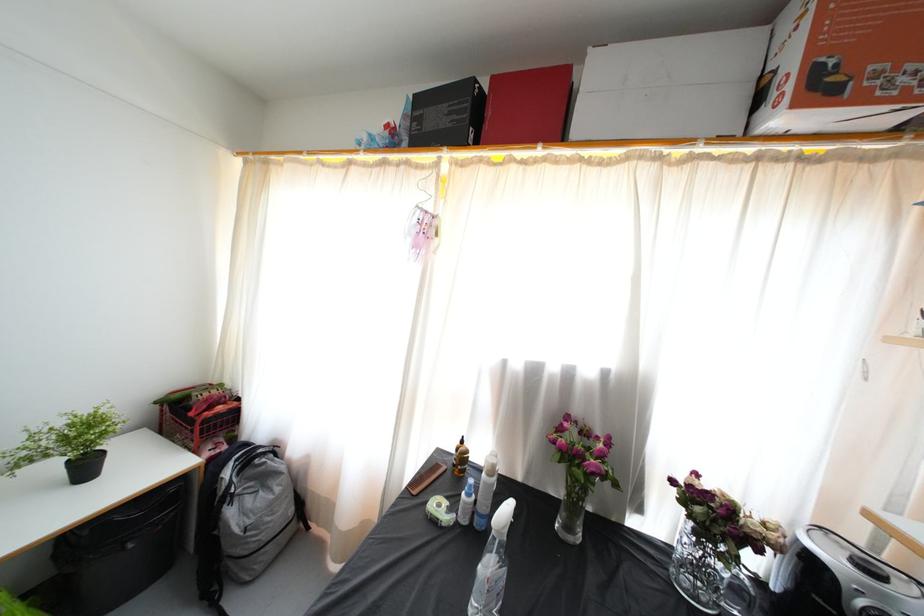
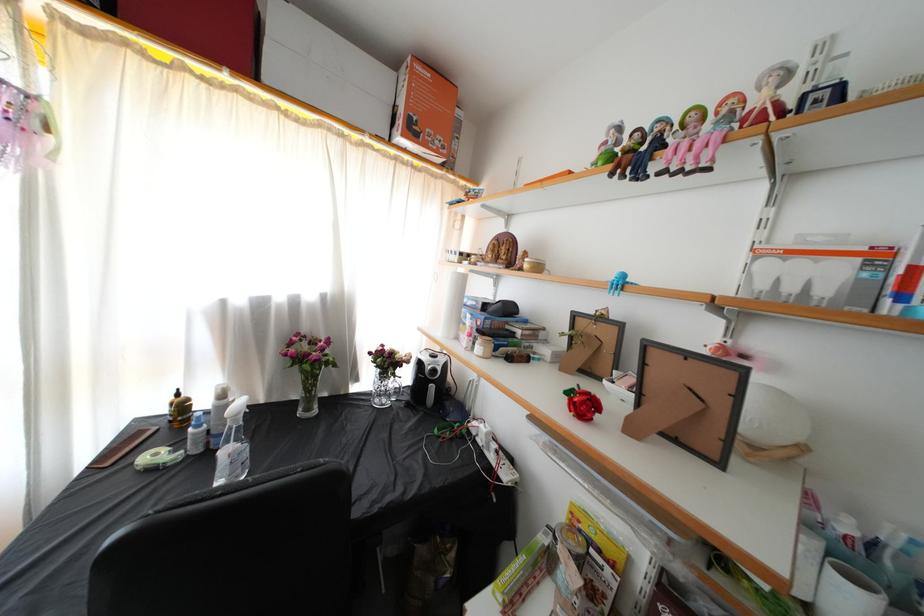
Find the pixel in the second image that matches point 574,501 in the first image.

(310, 392)